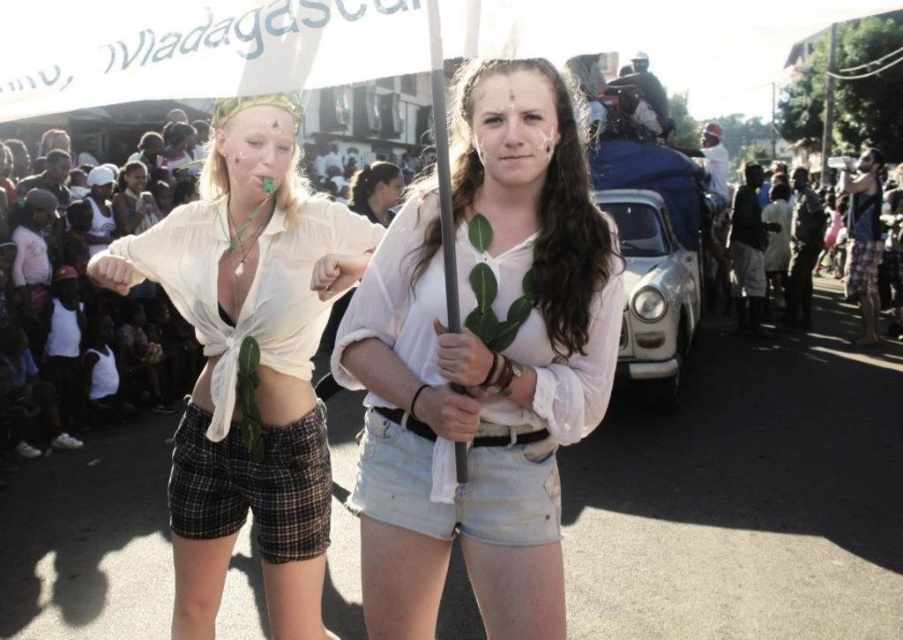
Which is behind, point (542, 412) or point (871, 300)?

The point (871, 300) is more distant.

Can you confirm if white cotton shirt at center is positioned to the right of dark skin people at right?

No, white cotton shirt at center is not to the right of dark skin people at right.

Who is more forward, (585, 240) or (842, 189)?

Point (585, 240) is more forward.

The image size is (903, 640). What are the coordinates of `white cotton shirt at center` in the screenshot? It's located at (482, 362).

Can you confirm if matte white blouse at center is smaller than dark skin people at right?

Yes, matte white blouse at center is smaller than dark skin people at right.

Between matte white blouse at center and dark skin people at right, which one has less height?

Standing shorter between the two is matte white blouse at center.

Is point (212, 296) positioned behind point (868, 308)?

That is False.

The image size is (903, 640). Identify the location of matte white blouse at center. (249, 362).

Which is below, white cotton shirt at center or matte white blouse at center?

matte white blouse at center is below.

Can you confirm if white cotton shirt at center is bigger than matte white blouse at center?

No, white cotton shirt at center is not bigger than matte white blouse at center.

Describe the element at coordinates (482, 362) in the screenshot. I see `white cotton shirt at center` at that location.

Locate an element on the screen. white cotton shirt at center is located at coordinates click(x=482, y=362).